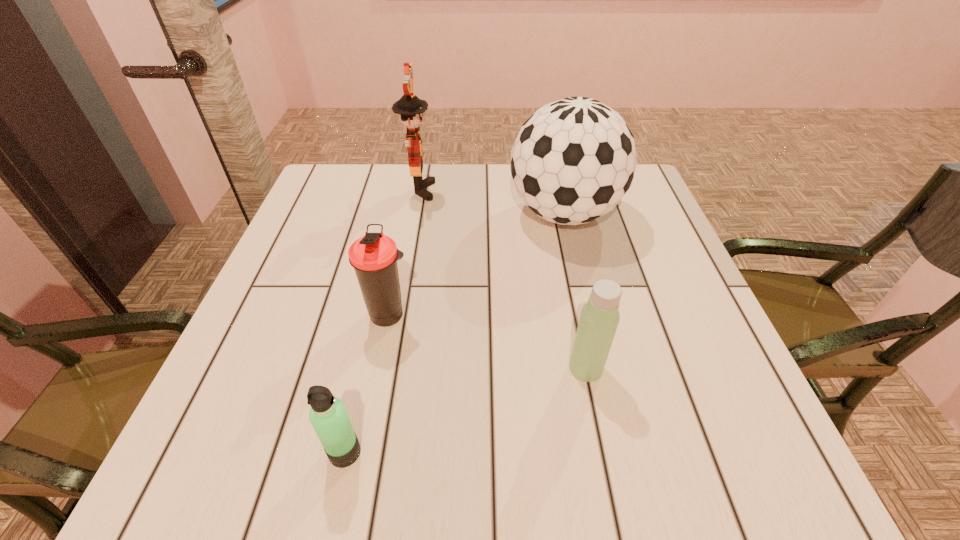
Locate an element on the screen. The image size is (960, 540). vacant point located on the back of the nearest object is located at coordinates (355, 408).

I want to click on nutcracker that is at the far edge, so [411, 108].

Locate an element on the screen. soccer ball that is at the far edge is located at coordinates (573, 160).

I want to click on object at the near edge, so click(328, 416).

Where is `object present at the right edge`? object present at the right edge is located at coordinates (573, 160).

Locate an element on the screen. Image resolution: width=960 pixels, height=540 pixels. object situated at the far right corner is located at coordinates (573, 160).

In the image, there is a desktop. In order to click on vacant space at the far edge in this screenshot , I will do `click(397, 177)`.

Find the location of a particular element. The height and width of the screenshot is (540, 960). vacant space at the near edge of the desktop is located at coordinates pos(604,454).

Identify the location of vacant point at the left edge. The height and width of the screenshot is (540, 960). (284, 320).

Image resolution: width=960 pixels, height=540 pixels. Identify the location of free space at the right edge of the desktop. (668, 238).